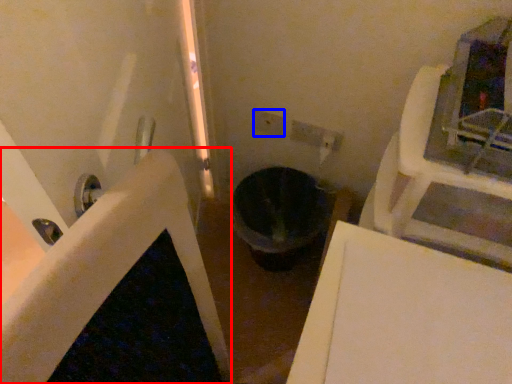
Question: Which object is closer to the camera taking this photo, bath (highlighted by a red box) or electric outlet (highlighted by a blue box)?

Choices:
 (A) bath
 (B) electric outlet

Answer: (B)